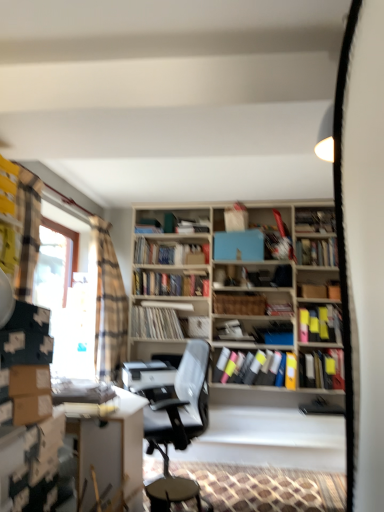
Question: Is wooden bar stool at center located within matte plastic books at center, which ranks as the second book in bottom-to-top order?

Choices:
 (A) yes
 (B) no

Answer: (B)

Question: From a real-world perspective, is matte plastic books at center, which ranks as the second book in bottom-to-top order, below wooden bar stool at center?

Choices:
 (A) no
 (B) yes

Answer: (A)

Question: Can you confirm if matte plastic books at center, which is counted as the ninth book, starting from the top, is shorter than wooden bar stool at center?

Choices:
 (A) no
 (B) yes

Answer: (A)

Question: Is matte plastic books at center, which is counted as the ninth book, starting from the top, to the right of wooden bar stool at center from the viewer's perspective?

Choices:
 (A) no
 (B) yes

Answer: (B)

Question: From a real-world perspective, is matte plastic books at center, which is counted as the ninth book, starting from the top, positioned over wooden bar stool at center based on gravity?

Choices:
 (A) yes
 (B) no

Answer: (A)

Question: In terms of width, does wooden crate at center, which is the fourth book from top to bottom, look wider or thinner when compared to matte black book at right, which ranks as the third book in bottom-to-top order?

Choices:
 (A) thin
 (B) wide

Answer: (B)

Question: From a real-world perspective, relative to matte black book at right, arranged as the 8th book when viewed from the top, is wooden crate at center, the 7th book ordered from the bottom, vertically above or below?

Choices:
 (A) above
 (B) below

Answer: (A)

Question: Considering the positions of point (278, 314) and point (329, 356), is point (278, 314) closer or farther from the camera than point (329, 356)?

Choices:
 (A) closer
 (B) farther

Answer: (B)

Question: Visually, is wooden crate at center, which is the fourth book from top to bottom, positioned to the left or to the right of matte black book at right, which ranks as the third book in bottom-to-top order?

Choices:
 (A) right
 (B) left

Answer: (B)

Question: Considering their positions, is hardcover book at center, arranged as the 9th book when ordered from the bottom, located in front of or behind hardcover books at center, which ranks as the 8th book in bottom-to-top order?

Choices:
 (A) front
 (B) behind

Answer: (A)

Question: Does point (332, 243) appear closer or farther from the camera than point (144, 292)?

Choices:
 (A) farther
 (B) closer

Answer: (B)

Question: From the image's perspective, is hardcover book at center, arranged as the 9th book when ordered from the bottom, located above or below hardcover books at center, positioned as the 3th book in top-to-bottom order?

Choices:
 (A) below
 (B) above

Answer: (B)

Question: Looking at their shapes, would you say hardcover book at center, the 2th book when ordered from top to bottom, is wider or thinner than hardcover books at center, positioned as the 3th book in top-to-bottom order?

Choices:
 (A) thin
 (B) wide

Answer: (B)

Question: Considering the positions of point (94, 342) and point (175, 412), is point (94, 342) closer or farther from the camera than point (175, 412)?

Choices:
 (A) farther
 (B) closer

Answer: (A)

Question: Considering the positions of plaid fabric curtain at left and gray fabric office chair at center in the image, is plaid fabric curtain at left taller or shorter than gray fabric office chair at center?

Choices:
 (A) short
 (B) tall

Answer: (B)